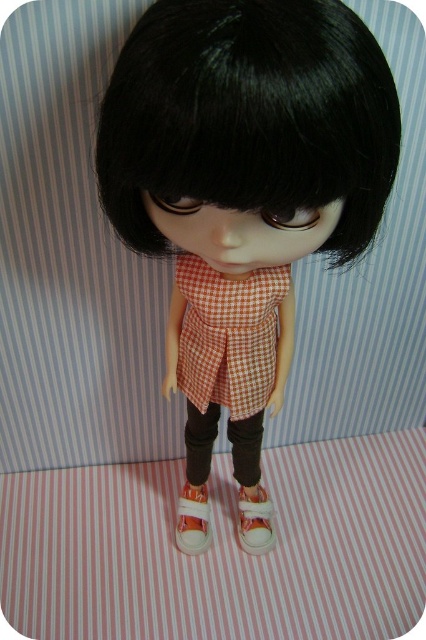
Question: Considering the real-world distances, which object is closest to the white canvas shoe at lower center?

Choices:
 (A) black matte wig at center
 (B) checkered fabric dress at center
 (C) white canvas shoe at center

Answer: (C)

Question: From the image, what is the correct spatial relationship of black matte wig at center in relation to white canvas shoe at center?

Choices:
 (A) above
 (B) below

Answer: (A)

Question: Which object is the closest to the checkered fabric dress at center?

Choices:
 (A) black matte wig at center
 (B) white canvas shoe at lower center
 (C) white canvas shoe at center

Answer: (A)

Question: Does black matte wig at center appear under white canvas shoe at center?

Choices:
 (A) no
 (B) yes

Answer: (A)

Question: Which point is closer to the camera taking this photo?

Choices:
 (A) pyautogui.click(x=118, y=92)
 (B) pyautogui.click(x=281, y=276)

Answer: (A)

Question: Is checkered fabric dress at center to the right of white canvas shoe at center from the viewer's perspective?

Choices:
 (A) yes
 (B) no

Answer: (B)